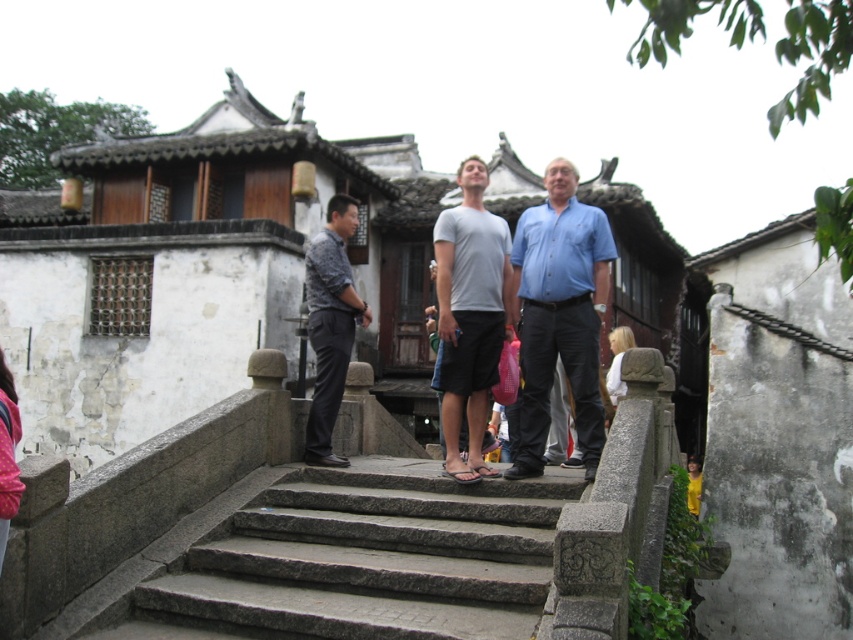
Question: Estimate the real-world distances between objects in this image. Which object is closer to the brown leather sandal at center?

Choices:
 (A) light gray t-shirt at center
 (B) blue cotton shirt at center
 (C) gray stone stairs at center
 (D) white cotton shirt at center

Answer: (C)

Question: Estimate the real-world distances between objects in this image. Which object is farther from the blue cotton shirt at center?

Choices:
 (A) brown leather sandal at center
 (B) gray stone stairs at center
 (C) dark gray fabric shirt at center
 (D) light gray t-shirt at center

Answer: (C)

Question: Which point appears farthest from the camera in this image?

Choices:
 (A) (445, 364)
 (B) (621, 332)
 (C) (572, 276)
 (D) (473, 477)

Answer: (B)

Question: Is light gray t-shirt at center further to the viewer compared to dark gray fabric shirt at center?

Choices:
 (A) no
 (B) yes

Answer: (A)

Question: Is blue cotton shirt at center below brown leather sandal at center?

Choices:
 (A) no
 (B) yes

Answer: (A)

Question: From the image, what is the correct spatial relationship of blue cotton shirt at center in relation to brown leather sandal at center?

Choices:
 (A) below
 (B) above

Answer: (B)